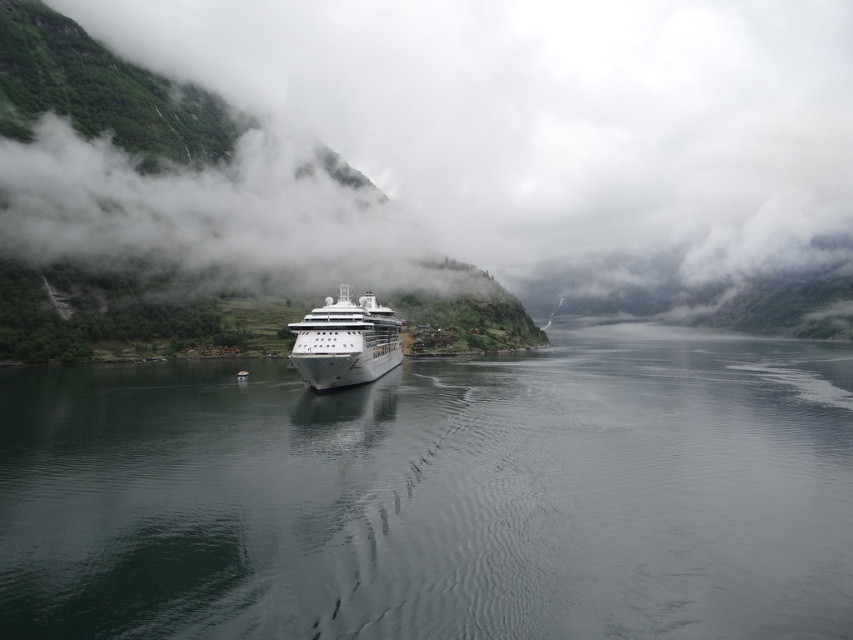
You are standing on the deck of the cruise ship and looking out. You see the point marked as point [437,497]. What is located at that point?

The point [437,497] marks dark gray water at center.

You are a captain of a ship and need to navigate through a narrow fjord. You see the dark gray water at center and the white glossy cruise ship at center. Which one is wider?

The dark gray water at center might be wider than white glossy cruise ship at center.

You are a passenger on the cruise ship and looking out the window. You see the dark gray water at center and the green matte cloud at center. Which object is located to the right side of the other?

The dark gray water at center is to the left of the green matte cloud at center, so the green matte cloud at center is located to the right side of the dark gray water at center.